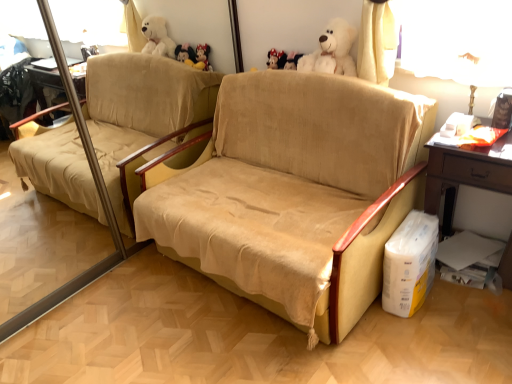
Image resolution: width=512 pixels, height=384 pixels. What are the coordinates of `free space on the front side of wooden table at right` in the screenshot? It's located at (472, 328).